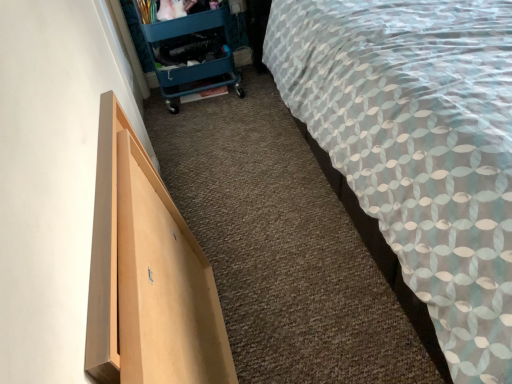
Question: Can you confirm if teal plastic trolley at upper left is shorter than patterned fabric bed at right?

Choices:
 (A) yes
 (B) no

Answer: (A)

Question: Is the position of teal plastic trolley at upper left less distant than that of patterned fabric bed at right?

Choices:
 (A) no
 (B) yes

Answer: (A)

Question: Is teal plastic trolley at upper left outside patterned fabric bed at right?

Choices:
 (A) yes
 (B) no

Answer: (A)

Question: Is teal plastic trolley at upper left smaller than patterned fabric bed at right?

Choices:
 (A) yes
 (B) no

Answer: (A)

Question: From a real-world perspective, is teal plastic trolley at upper left located higher than patterned fabric bed at right?

Choices:
 (A) no
 (B) yes

Answer: (A)

Question: From the image's perspective, is patterned fabric bed at right located above or below teal plastic trolley at upper left?

Choices:
 (A) below
 (B) above

Answer: (A)

Question: From a real-world perspective, relative to teal plastic trolley at upper left, is patterned fabric bed at right vertically above or below?

Choices:
 (A) above
 (B) below

Answer: (A)

Question: Considering the relative positions of patterned fabric bed at right and teal plastic trolley at upper left in the image provided, is patterned fabric bed at right to the left or to the right of teal plastic trolley at upper left?

Choices:
 (A) right
 (B) left

Answer: (A)

Question: Based on their sizes in the image, would you say patterned fabric bed at right is bigger or smaller than teal plastic trolley at upper left?

Choices:
 (A) small
 (B) big

Answer: (B)

Question: Visually, is patterned fabric bed at right positioned to the left or to the right of light wood drawer at left?

Choices:
 (A) right
 (B) left

Answer: (A)

Question: From a real-world perspective, is patterned fabric bed at right positioned above or below light wood drawer at left?

Choices:
 (A) above
 (B) below

Answer: (A)

Question: Relative to light wood drawer at left, is patterned fabric bed at right in front or behind?

Choices:
 (A) front
 (B) behind

Answer: (A)

Question: Considering the positions of patterned fabric bed at right and light wood drawer at left in the image, is patterned fabric bed at right taller or shorter than light wood drawer at left?

Choices:
 (A) tall
 (B) short

Answer: (A)

Question: Does point (206, 34) appear closer or farther from the camera than point (111, 190)?

Choices:
 (A) closer
 (B) farther

Answer: (B)

Question: From a real-world perspective, is teal plastic trolley at upper left physically located above or below light wood drawer at left?

Choices:
 (A) below
 (B) above

Answer: (B)